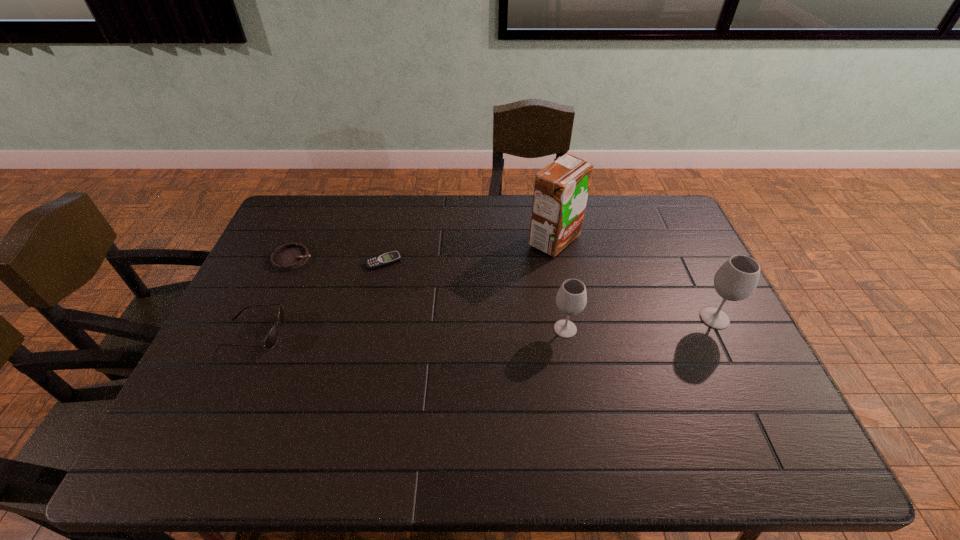
You are a GUI agent. You are given a task and a screenshot of the screen. Output one action in this format:
    pyautogui.click(x=<x>, y=<y>)
    Task: Click on the third tallest object
    The image size is (960, 540).
    Given the screenshot: What is the action you would take?
    [x=571, y=299]

Find the location of a particular element. the left wineglass is located at coordinates (571, 299).

In order to click on the right wineglass in this screenshot , I will do `click(737, 279)`.

This screenshot has height=540, width=960. What are the coordinates of `the taller wineglass` in the screenshot? It's located at (737, 279).

Locate an element on the screen. The width and height of the screenshot is (960, 540). carton is located at coordinates (561, 189).

This screenshot has width=960, height=540. I want to click on sunglasses, so click(270, 341).

Find the location of a particular element. This screenshot has height=540, width=960. the shortest object is located at coordinates (392, 257).

You are a GUI agent. You are given a task and a screenshot of the screen. Output one action in this format:
    pyautogui.click(x=<x>, y=<y>)
    Task: Click on the beeper
    
    Given the screenshot: What is the action you would take?
    pyautogui.click(x=392, y=257)

The width and height of the screenshot is (960, 540). Find the location of `the fifth tallest object`. the fifth tallest object is located at coordinates (291, 256).

The width and height of the screenshot is (960, 540). Find the location of `vacant space situated on the back of the shorter wineglass`. vacant space situated on the back of the shorter wineglass is located at coordinates (554, 265).